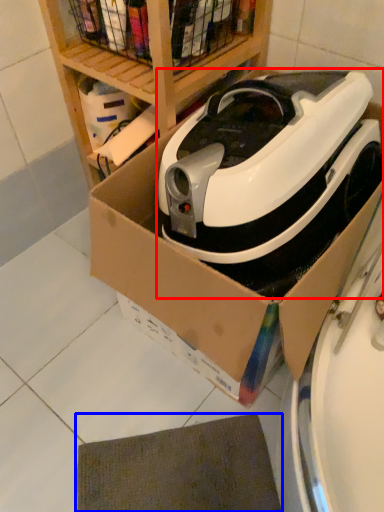
Question: Among these objects, which one is nearest to the camera, home appliance (highlighted by a red box) or mat (highlighted by a blue box)?

Choices:
 (A) home appliance
 (B) mat

Answer: (A)